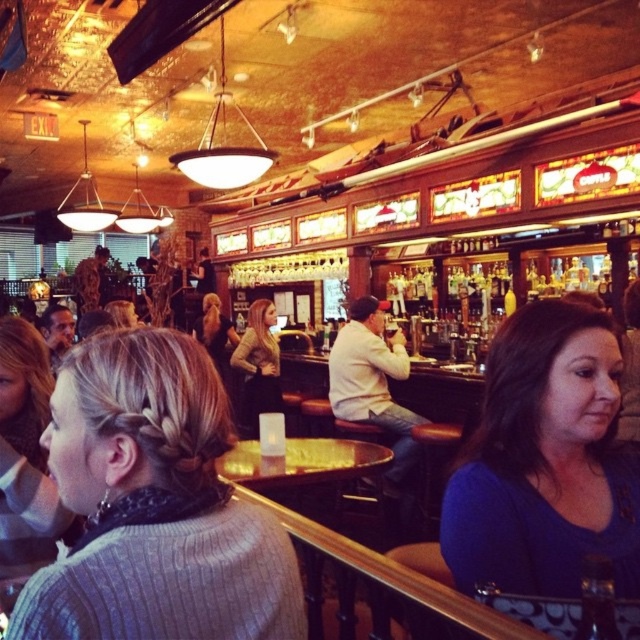
Is golden textured sweater at center positioned in front of blonde hair at center?

Yes, it is.

Where is `golden textured sweater at center`? The width and height of the screenshot is (640, 640). golden textured sweater at center is located at coordinates (259, 364).

You are a GUI agent. You are given a task and a screenshot of the screen. Output one action in this format:
    pyautogui.click(x=<x>, y=<y>)
    Task: Click on the golden textured sweater at center
    The image size is (640, 640).
    Given the screenshot: What is the action you would take?
    [259, 364]

Can you confirm if knitted sweater at center is positioned to the right of golden textured sweater at center?

Correct, you'll find knitted sweater at center to the right of golden textured sweater at center.

Who is taller, knitted sweater at center or golden textured sweater at center?

golden textured sweater at center is taller.

Which is behind, point (84, 428) or point (266, 344)?

The point (266, 344) is behind.

Identify the location of knitted sweater at center. The height and width of the screenshot is (640, 640). (154, 506).

Can you confirm if blue matte shirt at center is wider than golden textured sweater at center?

Correct, the width of blue matte shirt at center exceeds that of golden textured sweater at center.

Who is taller, blue matte shirt at center or golden textured sweater at center?

Standing taller between the two is golden textured sweater at center.

Is point (580, 429) closer to viewer compared to point (260, 339)?

Yes, point (580, 429) is closer to viewer.

This screenshot has width=640, height=640. What are the coordinates of `blue matte shirt at center` in the screenshot? It's located at (545, 461).